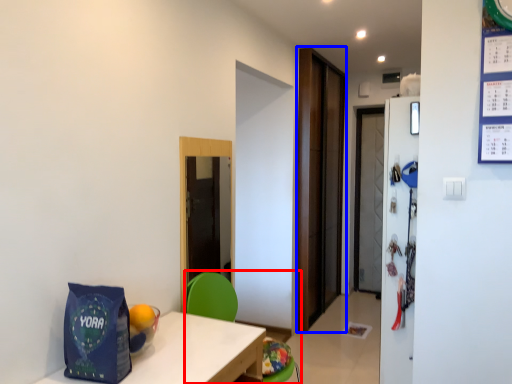
Question: Which point is further to the camera, armchair (highlighted by a red box) or door (highlighted by a blue box)?

Choices:
 (A) armchair
 (B) door

Answer: (B)